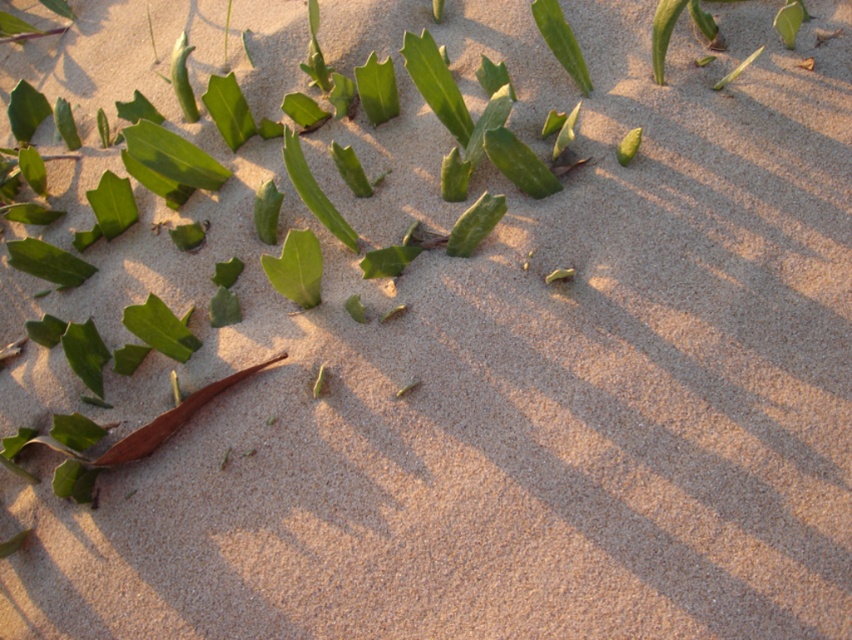
Question: Does green matte leaf at center appear on the right side of green matte leaf at upper center?

Choices:
 (A) no
 (B) yes

Answer: (A)

Question: Is green matte leaf at center wider than green matte leaf at upper center?

Choices:
 (A) yes
 (B) no

Answer: (B)

Question: Which of the following is the farthest from the observer?

Choices:
 (A) green matte leaf at upper center
 (B) green matte leaf at center

Answer: (A)

Question: Among these points, which one is nearest to the camera?

Choices:
 (A) (563, 42)
 (B) (262, 266)

Answer: (B)

Question: Is green matte leaf at center behind green matte leaf at upper center?

Choices:
 (A) yes
 (B) no

Answer: (B)